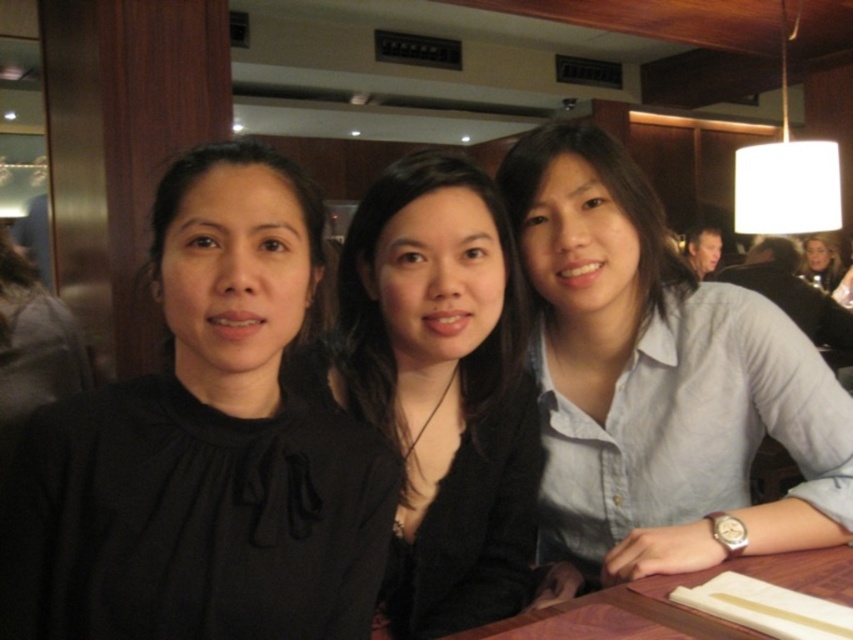
You are standing in a restaurant and see a point at coordinates (x=648, y=326). If you want to place a small vase there, will it fit comfortably without being too close to the three people seated nearby?

The point at coordinates (x=648, y=326) is 1.16 meters away from you, so placing a small vase there should be comfortable as it is a reasonable distance from the seated individuals.